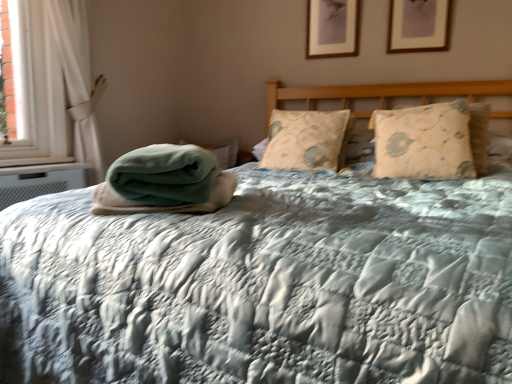
Question: Should I look upward or downward to see matte wooden picture frame at upper center, the second picture frame viewed from the right?

Choices:
 (A) up
 (B) down

Answer: (A)

Question: Can you confirm if beige quilted pillow at right, placed as the second pillow when sorted from left to right, is bigger than beige floral pillow at center, which ranks as the first pillow in left-to-right order?

Choices:
 (A) no
 (B) yes

Answer: (A)

Question: Considering the relative sizes of beige quilted pillow at right, placed as the second pillow when sorted from left to right, and beige floral pillow at center, which ranks as the first pillow in left-to-right order, in the image provided, is beige quilted pillow at right, placed as the second pillow when sorted from left to right, taller than beige floral pillow at center, which ranks as the first pillow in left-to-right order,?

Choices:
 (A) no
 (B) yes

Answer: (B)

Question: Could you tell me if beige quilted pillow at right, placed as the second pillow when sorted from left to right, is facing beige floral pillow at center, which ranks as the first pillow in left-to-right order?

Choices:
 (A) yes
 (B) no

Answer: (B)

Question: Is beige floral pillow at center, the second pillow from the right, surrounded by beige quilted pillow at right, the first pillow positioned from the right?

Choices:
 (A) yes
 (B) no

Answer: (B)

Question: From the image's perspective, is beige quilted pillow at right, placed as the second pillow when sorted from left to right, over beige floral pillow at center, which ranks as the first pillow in left-to-right order?

Choices:
 (A) yes
 (B) no

Answer: (B)

Question: Can you confirm if beige quilted pillow at right, placed as the second pillow when sorted from left to right, is positioned to the right of beige floral pillow at center, the second pillow from the right?

Choices:
 (A) yes
 (B) no

Answer: (A)

Question: Can you confirm if beige floral pillow at center, which ranks as the first pillow in left-to-right order, is thinner than wooden picture frame at upper center, the 1th picture frame positioned from the right?

Choices:
 (A) no
 (B) yes

Answer: (A)

Question: Is wooden picture frame at upper center, the 1th picture frame positioned from the right, at the back of beige floral pillow at center, which ranks as the first pillow in left-to-right order?

Choices:
 (A) no
 (B) yes

Answer: (A)

Question: Is beige floral pillow at center, which ranks as the first pillow in left-to-right order, located outside wooden picture frame at upper center, the 1th picture frame positioned from the right?

Choices:
 (A) no
 (B) yes

Answer: (B)

Question: From the image's perspective, is beige floral pillow at center, the second pillow from the right, over wooden picture frame at upper center, which is the 2th picture frame from back to front?

Choices:
 (A) no
 (B) yes

Answer: (A)

Question: Is beige floral pillow at center, the second pillow from the right, wider than wooden picture frame at upper center, which is the 2th picture frame from back to front?

Choices:
 (A) yes
 (B) no

Answer: (A)

Question: Is beige floral pillow at center, the second pillow from the right, directly adjacent to wooden picture frame at upper center, the 1th picture frame positioned from the right?

Choices:
 (A) no
 (B) yes

Answer: (A)

Question: From a real-world perspective, is beige quilted pillow at right, the first pillow positioned from the right, positioned over white fabric curtain at left based on gravity?

Choices:
 (A) yes
 (B) no

Answer: (B)